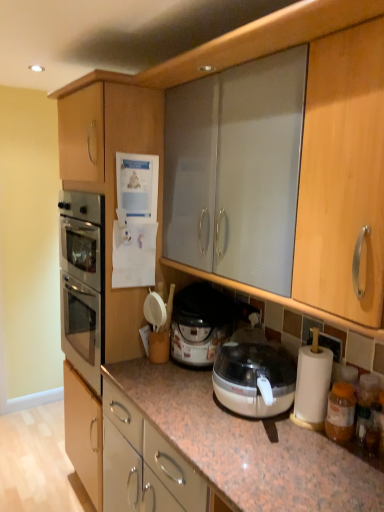
Locate an element on the screen. translucent plastic rice cooker at center is located at coordinates (200, 324).

What do you see at coordinates (200, 324) in the screenshot?
I see `translucent plastic rice cooker at center` at bounding box center [200, 324].

The image size is (384, 512). What do you see at coordinates (111, 175) in the screenshot?
I see `matte wood cabinet at left` at bounding box center [111, 175].

Image resolution: width=384 pixels, height=512 pixels. Find the location of `matte wood cabinet at left`. matte wood cabinet at left is located at coordinates (111, 175).

The image size is (384, 512). I want to click on translucent plastic rice cooker at center, so click(x=200, y=324).

Does translucent plastic rice cooker at center appear on the left side of matte wood cabinet at left?

No.

Relative to matte wood cabinet at left, is translucent plastic rice cooker at center in front or behind?

Visually, translucent plastic rice cooker at center is located behind matte wood cabinet at left.

Is point (209, 309) closer or farther from the camera than point (147, 118)?

Point (209, 309) is positioned farther from the camera compared to point (147, 118).

From the image's perspective, is translucent plastic rice cooker at center over matte wood cabinet at left?

No, from the image's perspective, translucent plastic rice cooker at center is not above matte wood cabinet at left.

From a real-world perspective, between translucent plastic rice cooker at center and matte wood cabinet at left, who is vertically lower?

In real-world perspective, matte wood cabinet at left is lower.

Between translucent plastic rice cooker at center and matte wood cabinet at left, which one has smaller width?

Thinner between the two is translucent plastic rice cooker at center.

Considering the sizes of objects translucent plastic rice cooker at center and matte wood cabinet at left in the image provided, who is shorter, translucent plastic rice cooker at center or matte wood cabinet at left?

Standing shorter between the two is translucent plastic rice cooker at center.

Based on the photo, is translucent plastic rice cooker at center smaller than matte wood cabinet at left?

Correct, translucent plastic rice cooker at center occupies less space than matte wood cabinet at left.

Is translucent plastic rice cooker at center positioned beyond the bounds of matte wood cabinet at left?

Yes, translucent plastic rice cooker at center is outside of matte wood cabinet at left.

Is there a large distance between translucent plastic rice cooker at center and matte wood cabinet at left?

translucent plastic rice cooker at center is near matte wood cabinet at left, not far away.

Could you tell me if translucent plastic rice cooker at center is facing matte wood cabinet at left?

No, translucent plastic rice cooker at center is not turned towards matte wood cabinet at left.

Locate an element on the screen. The width and height of the screenshot is (384, 512). cabinetry in front of the translucent plastic rice cooker at center is located at coordinates (111, 175).

Looking at this image, is matte wood cabinet at left to the right of translucent plastic rice cooker at center from the viewer's perspective?

Incorrect, matte wood cabinet at left is not on the right side of translucent plastic rice cooker at center.

Considering the relative positions of matte wood cabinet at left and translucent plastic rice cooker at center in the image provided, is matte wood cabinet at left behind translucent plastic rice cooker at center?

No, matte wood cabinet at left is in front of translucent plastic rice cooker at center.

Is point (111, 318) closer to camera compared to point (180, 318)?

No, (111, 318) is behind (180, 318).

From the image's perspective, is matte wood cabinet at left located above translucent plastic rice cooker at center?

Yes, from the image's perspective, matte wood cabinet at left is over translucent plastic rice cooker at center.

From a real-world perspective, is matte wood cabinet at left located beneath translucent plastic rice cooker at center?

Yes, from a real-world perspective, matte wood cabinet at left is beneath translucent plastic rice cooker at center.

Based on the photo, between matte wood cabinet at left and translucent plastic rice cooker at center, which one has larger width?

matte wood cabinet at left.

Can you confirm if matte wood cabinet at left is taller than translucent plastic rice cooker at center?

Yes, matte wood cabinet at left is taller than translucent plastic rice cooker at center.

Is matte wood cabinet at left bigger than translucent plastic rice cooker at center?

Yes, matte wood cabinet at left is bigger than translucent plastic rice cooker at center.

Is matte wood cabinet at left positioned beyond the bounds of translucent plastic rice cooker at center?

matte wood cabinet at left lies outside translucent plastic rice cooker at center's area.

Are matte wood cabinet at left and translucent plastic rice cooker at center beside each other?

matte wood cabinet at left and translucent plastic rice cooker at center are not in contact.

Is matte wood cabinet at left looking in the opposite direction of translucent plastic rice cooker at center?

matte wood cabinet at left is not turned away from translucent plastic rice cooker at center.

Measure the distance from matte wood cabinet at left to translucent plastic rice cooker at center.

matte wood cabinet at left and translucent plastic rice cooker at center are 46.53 centimeters apart.

Where is `cooker that appears below the matte wood cabinet at left (from the image's perspective)`? The height and width of the screenshot is (512, 384). cooker that appears below the matte wood cabinet at left (from the image's perspective) is located at coordinates (200, 324).

Where is `cabinetry located on the left of translucent plastic rice cooker at center`? cabinetry located on the left of translucent plastic rice cooker at center is located at coordinates (111, 175).

In the image, there is a translucent plastic rice cooker at center. Find the location of `cabinetry below it (from a real-world perspective)`. cabinetry below it (from a real-world perspective) is located at coordinates (111, 175).